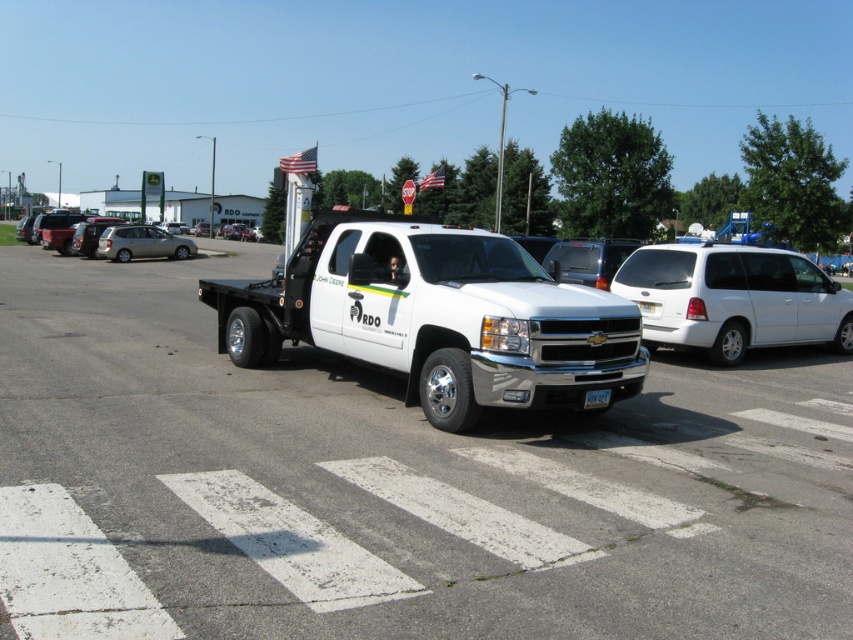
You are standing at the point marked by the coordinates point (x=141, y=243). What object is located exactly at this point?

The satin silver sedan at left is located exactly at point (x=141, y=243).

From the picture: You are a tow truck operator who needs to tow both the white glossy minivan at center and the silver metallic sedan at center. Based on their sizes, which vehicle should you tow first to ensure the tow truck can handle both without overloading?

The white glossy minivan at center has a smaller size compared to the silver metallic sedan at center. Therefore, you should tow the smaller vehicle first to ensure the tow truck can handle both without overloading.